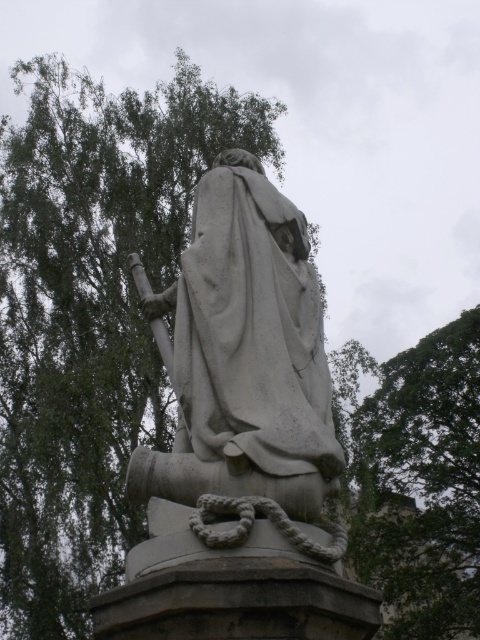
Question: Where is green leafy tree at upper left located in relation to green leafy tree at upper right in the image?

Choices:
 (A) below
 (B) above

Answer: (B)

Question: Can you confirm if white stone statue at center is thinner than green leafy tree at upper right?

Choices:
 (A) no
 (B) yes

Answer: (B)

Question: Does green leafy tree at upper left lie in front of green leafy tree at upper right?

Choices:
 (A) no
 (B) yes

Answer: (B)

Question: Which point is closer to the camera taking this photo?

Choices:
 (A) (143, 401)
 (B) (472, 556)

Answer: (A)

Question: Which of the following is the farthest from the observer?

Choices:
 (A) (173, 186)
 (B) (224, 305)
 (C) (425, 634)

Answer: (C)

Question: Among these objects, which one is farthest from the camera?

Choices:
 (A) green leafy tree at upper right
 (B) green leafy tree at upper left

Answer: (A)